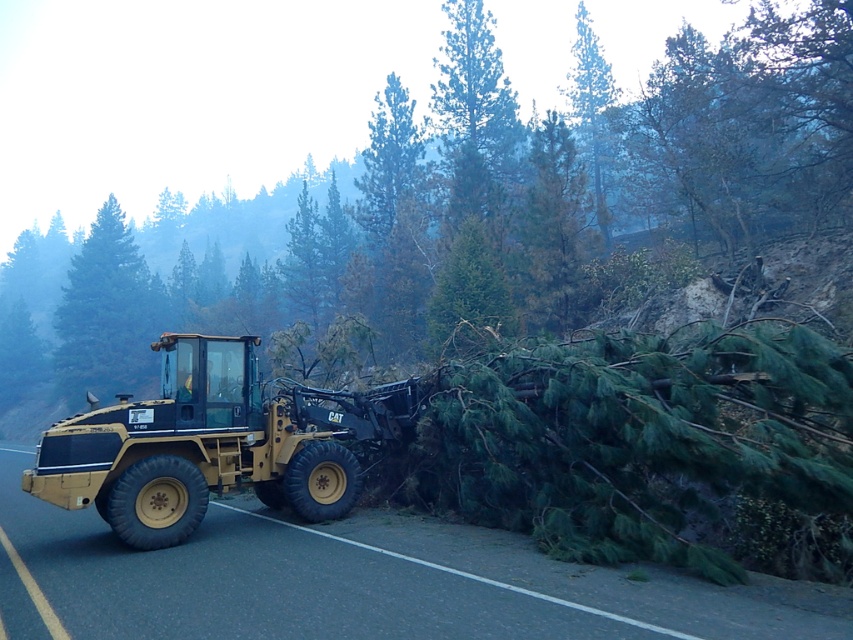
Who is higher up, green matte tree at left or green needle-like at upper center?

green needle-like at upper center is higher up.

The width and height of the screenshot is (853, 640). Find the location of `green matte tree at left`. green matte tree at left is located at coordinates (106, 310).

Find the location of a particular element. green matte tree at left is located at coordinates click(106, 310).

Which of these two, matte yellow tractor at center or green matte tree at left, stands shorter?

matte yellow tractor at center is shorter.

Is matte yellow tractor at center smaller than green matte tree at left?

Correct, matte yellow tractor at center occupies less space than green matte tree at left.

What do you see at coordinates (213, 444) in the screenshot? I see `matte yellow tractor at center` at bounding box center [213, 444].

Where is `matte yellow tractor at center`? Image resolution: width=853 pixels, height=640 pixels. matte yellow tractor at center is located at coordinates (213, 444).

Who is more forward, (x=111, y=620) or (x=235, y=372)?

Point (x=111, y=620) is more forward.

Between yellow rubber truck at left and matte yellow tractor at center, which one has more height?

matte yellow tractor at center

Between point (476, 632) and point (222, 483), which one is positioned behind?

Point (222, 483)

Find the location of a particular element. The width and height of the screenshot is (853, 640). yellow rubber truck at left is located at coordinates (375, 582).